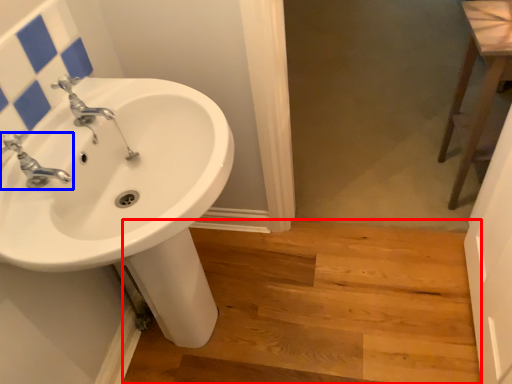
Question: Which object appears farthest to the camera in this image, stairwell (highlighted by a red box) or tap (highlighted by a blue box)?

Choices:
 (A) stairwell
 (B) tap

Answer: (A)